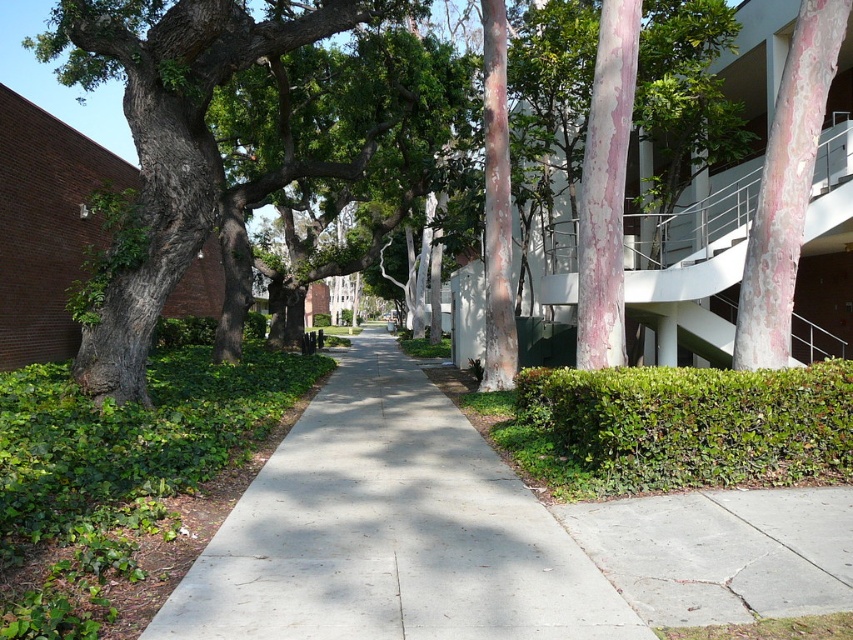
Is point (146, 54) more distant than point (724, 448)?

Yes, point (146, 54) is behind point (724, 448).

Can you confirm if green leafy tree at center is shorter than green leafy hedge at lower center?

In fact, green leafy tree at center may be taller than green leafy hedge at lower center.

At what (x,y) coordinates should I click in order to perform the action: click on green leafy tree at center. Please return your answer as a coordinate pair (x, y). This screenshot has height=640, width=853. Looking at the image, I should click on (178, 148).

Locate an element on the screen. This screenshot has height=640, width=853. green leafy tree at center is located at coordinates (178, 148).

Which is above, gray concrete sidewalk at center or white paper at center?

gray concrete sidewalk at center is above.

Is gray concrete sidewalk at center positioned behind white paper at center?

Yes, it is.

Between point (438, 570) and point (387, 609), which one is positioned behind?

Point (438, 570)

Locate an element on the screen. This screenshot has height=640, width=853. gray concrete sidewalk at center is located at coordinates (390, 531).

Does gray concrete sidewalk at lower right have a larger size compared to white paper at center?

Yes.

Which of these two, gray concrete sidewalk at lower right or white paper at center, stands taller?

With more height is gray concrete sidewalk at lower right.

Between point (741, 573) and point (389, 593), which one is positioned behind?

Point (741, 573)

The height and width of the screenshot is (640, 853). In order to click on gray concrete sidewalk at lower right in this screenshot , I will do `click(722, 552)`.